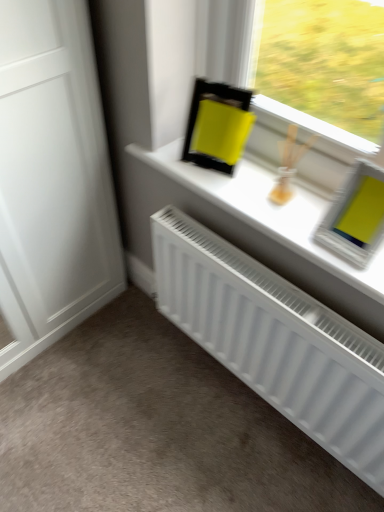
I want to click on free space below white matte radiator at lower center (from a real-world perspective), so click(x=254, y=398).